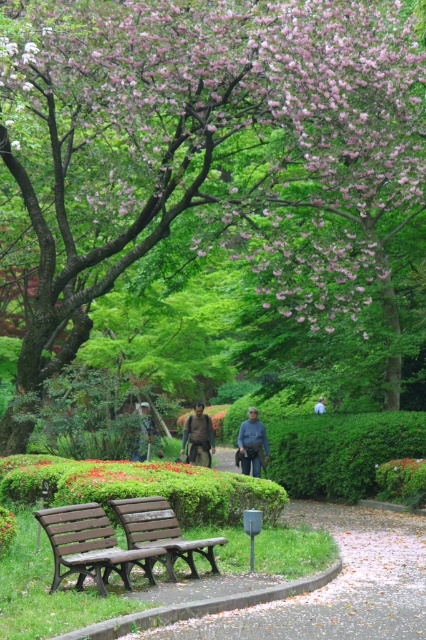
Question: Is brown fabric jacket at center positioned in front of dark blue uniform at center?

Choices:
 (A) yes
 (B) no

Answer: (A)

Question: Estimate the real-world distances between objects in this image. Which object is closer to the wooden bench at lower left?

Choices:
 (A) brown fabric jacket at center
 (B) dark gray fabric jacket at center
 (C) green leafy tree at center

Answer: (B)

Question: Among these objects, which one is farthest from the camera?

Choices:
 (A) green leafy tree at center
 (B) brown leather jacket at center
 (C) wooden bench at center

Answer: (B)

Question: Which is farther from the brown leather jacket at center?

Choices:
 (A) wooden bench at lower left
 (B) green leafy tree at center
 (C) dark blue uniform at center
 (D) brown fabric jacket at center

Answer: (A)

Question: From the image, what is the correct spatial relationship of wooden bench at center in relation to dark blue uniform at center?

Choices:
 (A) above
 (B) below

Answer: (B)

Question: Does brown leather jacket at center appear on the left side of light brown leather jacket at center?

Choices:
 (A) no
 (B) yes

Answer: (B)